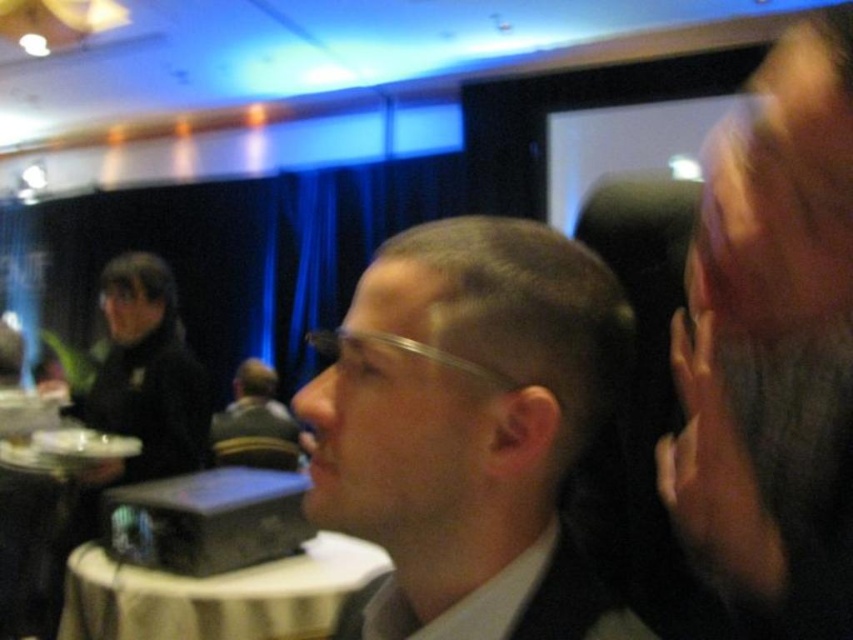
Question: Which point is farther to the camera?

Choices:
 (A) dark gray hair at upper right
 (B) black matte jacket at left

Answer: (B)

Question: Is dark gray hair at upper right bigger than white cloth-covered table at lower left?

Choices:
 (A) yes
 (B) no

Answer: (B)

Question: Which object is farther from the camera taking this photo?

Choices:
 (A) white cloth-covered table at lower left
 (B) white matte business suit at center
 (C) black matte jacket at left

Answer: (C)

Question: Which of the following is the closest to the observer?

Choices:
 (A) (140, 433)
 (B) (552, 531)

Answer: (B)

Question: Does white cloth-covered table at lower left have a greater width compared to white matte business suit at center?

Choices:
 (A) yes
 (B) no

Answer: (A)

Question: Can you confirm if matte black suit at center is bigger than white cloth-covered table at lower left?

Choices:
 (A) no
 (B) yes

Answer: (A)